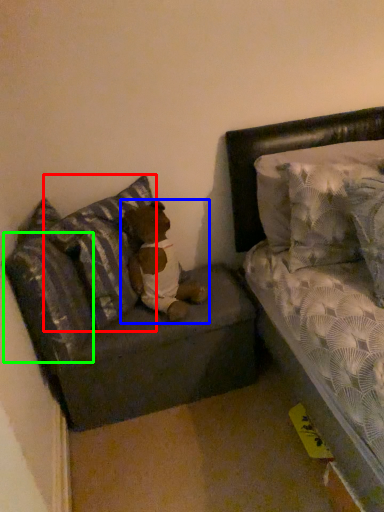
Question: Which object is the closest to the pillow (highlighted by a red box)? Choose among these: teddy (highlighted by a blue box) or pillow (highlighted by a green box).

Choices:
 (A) teddy
 (B) pillow

Answer: (A)